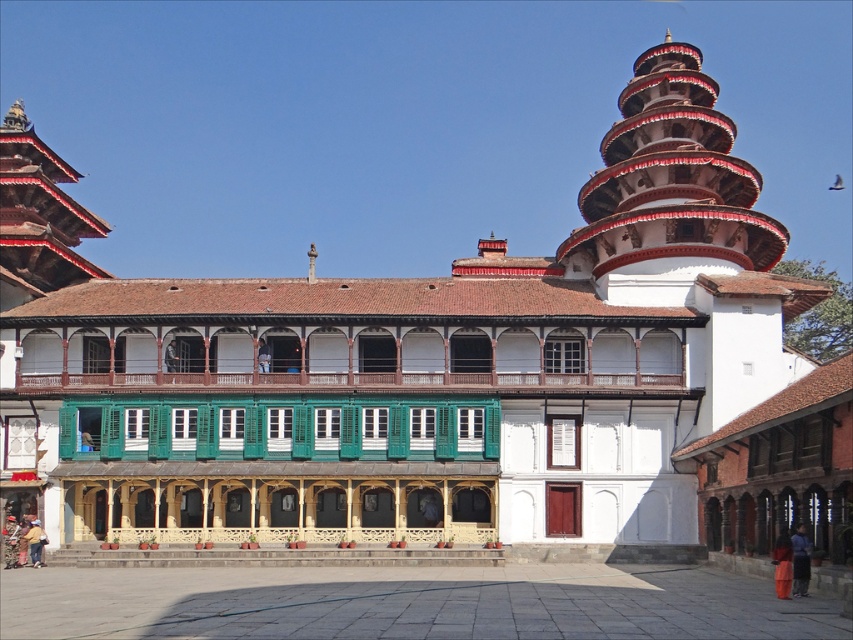
Measure the distance between white painted wood tower at upper right and camera.

white painted wood tower at upper right is 77.59 meters from camera.

Which is behind, point (645, 122) or point (801, 540)?

The point (645, 122) is more distant.

At what (x,y) coordinates should I click in order to perform the action: click on white painted wood tower at upper right. Please return your answer as a coordinate pair (x, y). The width and height of the screenshot is (853, 640). Looking at the image, I should click on (671, 179).